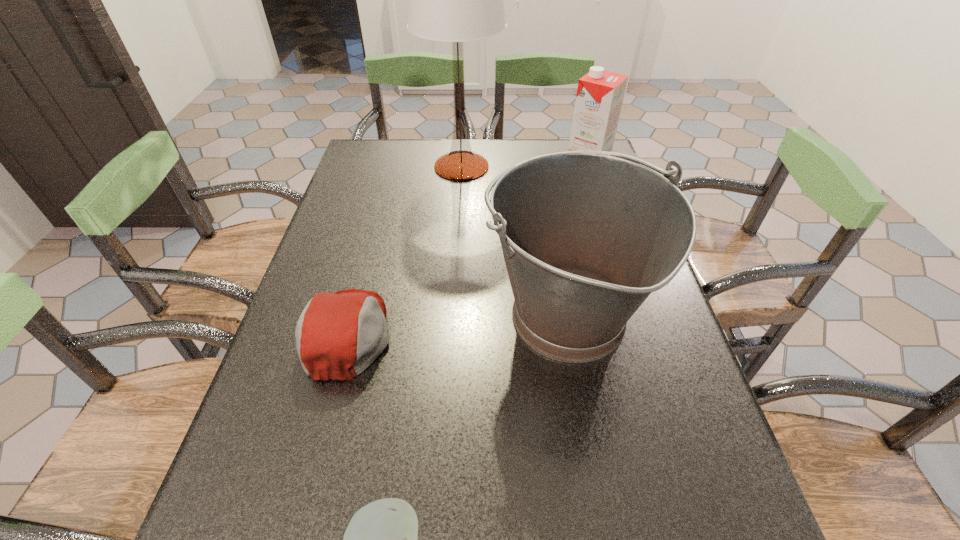
At what (x,y) coordinates should I click in order to perform the action: click on object positioned at the left edge. Please return your answer as a coordinate pair (x, y). This screenshot has height=540, width=960. Looking at the image, I should click on (338, 335).

Locate an element on the screen. This screenshot has height=540, width=960. bucket that is at the right edge is located at coordinates (587, 236).

The image size is (960, 540). In order to click on carton at the right edge in this screenshot , I will do `click(600, 93)`.

What are the coordinates of `object positioned at the far right corner` in the screenshot? It's located at [600, 93].

In the image, there is a desktop. Where is `free region at the far edge`? The height and width of the screenshot is (540, 960). free region at the far edge is located at coordinates (496, 146).

You are a GUI agent. You are given a task and a screenshot of the screen. Output one action in this format:
    pyautogui.click(x=<x>, y=<y>)
    Task: Click on the vacant space at the left edge of the desktop
    This screenshot has width=960, height=540.
    Given the screenshot: What is the action you would take?
    pyautogui.click(x=335, y=450)

Where is `blank space at the far left corner of the desktop`? Image resolution: width=960 pixels, height=540 pixels. blank space at the far left corner of the desktop is located at coordinates (396, 154).

The image size is (960, 540). Find the location of `free space between the cap and the table lamp`. free space between the cap and the table lamp is located at coordinates (405, 251).

You are a GUI agent. You are given a task and a screenshot of the screen. Output one action in this format:
    pyautogui.click(x=<x>, y=<y>)
    Task: Click on the vacant space that's between the leftmost object and the bucket
    Image resolution: width=960 pixels, height=540 pixels.
    Given the screenshot: What is the action you would take?
    pyautogui.click(x=457, y=327)

Where is `empty location between the carton and the cap`? This screenshot has width=960, height=540. empty location between the carton and the cap is located at coordinates (468, 253).